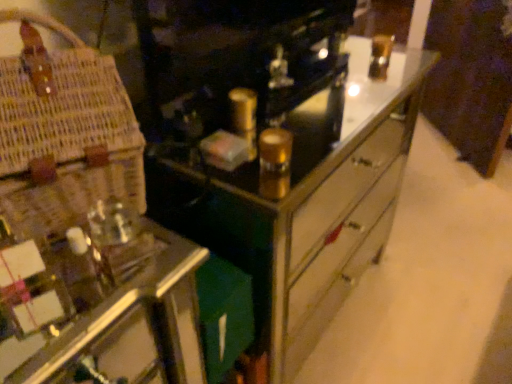
Question: Considering the relative sizes of metallic mirrored chest of drawers at center and woven straw basket at left in the image provided, is metallic mirrored chest of drawers at center wider than woven straw basket at left?

Choices:
 (A) yes
 (B) no

Answer: (A)

Question: Could you tell me if metallic mirrored chest of drawers at center is turned towards woven straw basket at left?

Choices:
 (A) no
 (B) yes

Answer: (A)

Question: From a real-world perspective, is metallic mirrored chest of drawers at center on top of woven straw basket at left?

Choices:
 (A) no
 (B) yes

Answer: (A)

Question: Can you confirm if metallic mirrored chest of drawers at center is taller than woven straw basket at left?

Choices:
 (A) yes
 (B) no

Answer: (A)

Question: Is metallic mirrored chest of drawers at center at the right side of woven straw basket at left?

Choices:
 (A) no
 (B) yes

Answer: (B)

Question: Can you confirm if metallic mirrored chest of drawers at center is bigger than woven straw basket at left?

Choices:
 (A) no
 (B) yes

Answer: (B)

Question: Does woven straw basket at left appear on the left side of metallic mirrored chest of drawers at center?

Choices:
 (A) no
 (B) yes

Answer: (B)

Question: Can you confirm if woven straw basket at left is bigger than metallic mirrored chest of drawers at center?

Choices:
 (A) yes
 (B) no

Answer: (B)

Question: Does woven straw basket at left appear on the right side of metallic mirrored chest of drawers at center?

Choices:
 (A) no
 (B) yes

Answer: (A)

Question: Is woven straw basket at left taller than metallic mirrored chest of drawers at center?

Choices:
 (A) no
 (B) yes

Answer: (A)

Question: From the image's perspective, is woven straw basket at left on top of metallic mirrored chest of drawers at center?

Choices:
 (A) no
 (B) yes

Answer: (B)

Question: Is woven straw basket at left oriented away from metallic mirrored chest of drawers at center?

Choices:
 (A) no
 (B) yes

Answer: (A)

Question: From a real-world perspective, is metallic mirrored chest of drawers at center positioned above or below woven straw basket at left?

Choices:
 (A) above
 (B) below

Answer: (B)